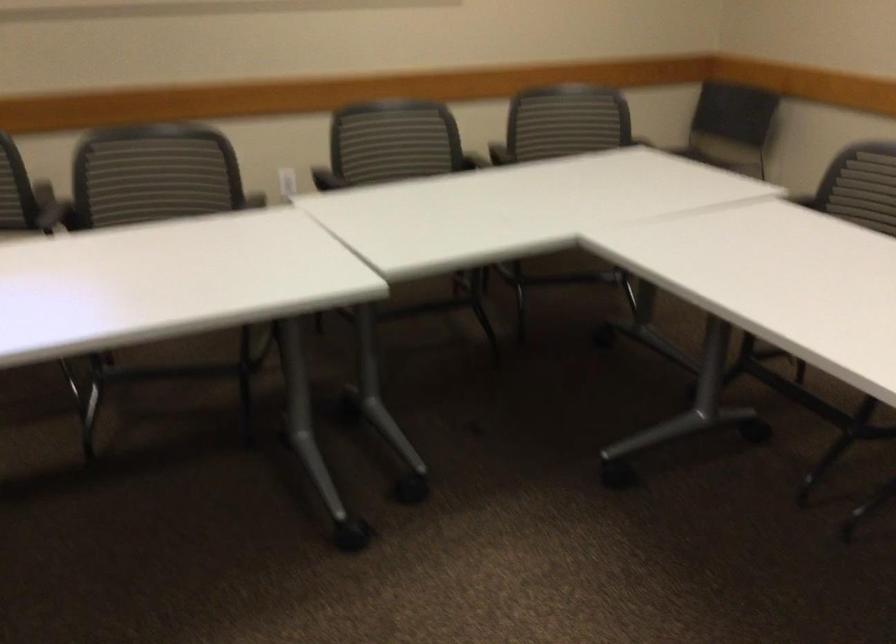
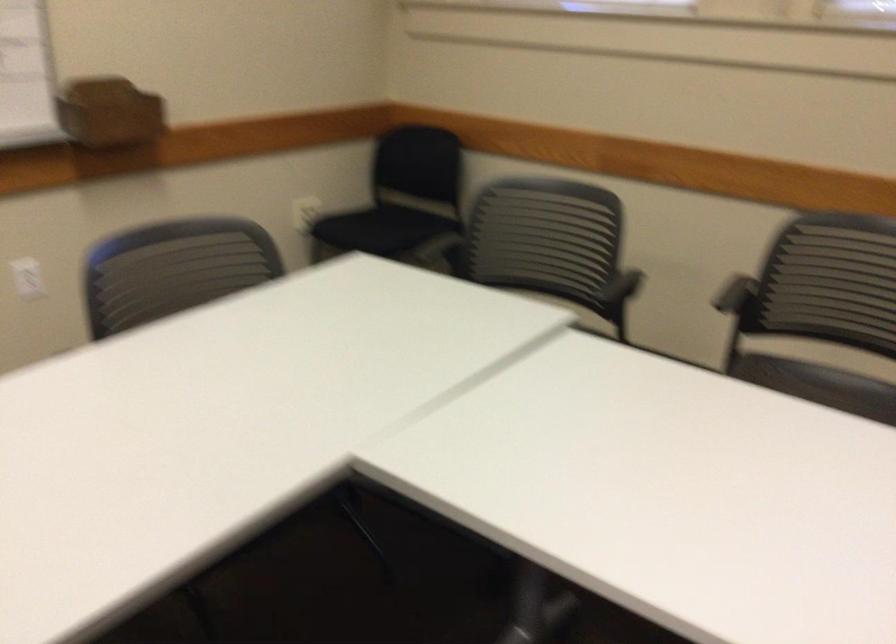
Question: Based on the continuous images, in which direction is the camera rotating? Reply with the corresponding letter.

Choices:
 (A) Left
 (B) Right
 (C) Up
 (D) Down

Answer: (A)